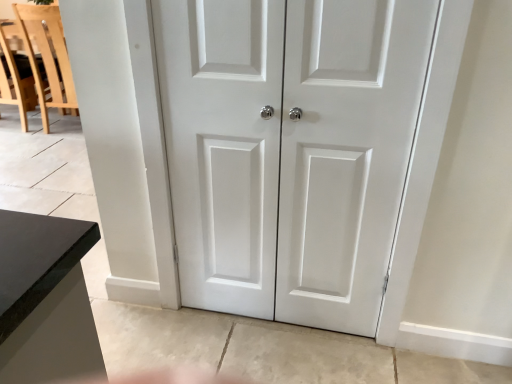
Question: From the image's perspective, is light wood chair at left positioned above or below white matte door at center?

Choices:
 (A) above
 (B) below

Answer: (A)

Question: Is light wood chair at left in front of or behind white matte door at center in the image?

Choices:
 (A) behind
 (B) front

Answer: (A)

Question: Which object is the closest to the light wood chair at left?

Choices:
 (A) white matte door at center
 (B) white matte door at center

Answer: (A)

Question: Based on their relative distances, which object is farther from the light wood chair at left?

Choices:
 (A) white matte door at center
 (B) white matte door at center

Answer: (A)